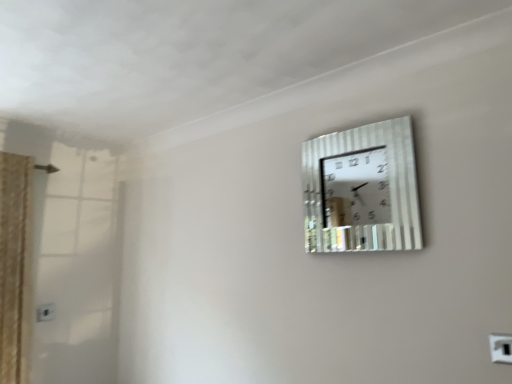
Question: Is white plastic electric outlet at lower left, placed as the 1th electric outlet when sorted from left to right, closer to the viewer compared to metallic silver wall clock at upper right?

Choices:
 (A) yes
 (B) no

Answer: (B)

Question: Can you see white plastic electric outlet at lower left, the first electric outlet when ordered from back to front, touching metallic silver wall clock at upper right?

Choices:
 (A) no
 (B) yes

Answer: (A)

Question: Can you confirm if white plastic electric outlet at lower left, the 2th electric outlet viewed from the front, is wider than metallic silver wall clock at upper right?

Choices:
 (A) no
 (B) yes

Answer: (A)

Question: From the image's perspective, is white plastic electric outlet at lower left, which appears as the second electric outlet when viewed from the right, below metallic silver wall clock at upper right?

Choices:
 (A) no
 (B) yes

Answer: (B)

Question: Is white plastic electric outlet at lower left, the 2th electric outlet viewed from the front, turned away from metallic silver wall clock at upper right?

Choices:
 (A) yes
 (B) no

Answer: (B)

Question: From the image's perspective, is white plastic electric outlet at lower left, the 2th electric outlet viewed from the front, positioned above or below white plastic electric outlet at upper right, which is the first electric outlet in front-to-back order?

Choices:
 (A) above
 (B) below

Answer: (B)

Question: Is point 53,319 closer or farther from the camera than point 504,342?

Choices:
 (A) farther
 (B) closer

Answer: (A)

Question: From a real-world perspective, is white plastic electric outlet at lower left, which appears as the second electric outlet when viewed from the right, above or below white plastic electric outlet at upper right, which is the first electric outlet in front-to-back order?

Choices:
 (A) below
 (B) above

Answer: (B)

Question: In the image, is white plastic electric outlet at lower left, which appears as the second electric outlet when viewed from the right, on the left side or the right side of white plastic electric outlet at upper right, the 2th electric outlet from the back?

Choices:
 (A) left
 (B) right

Answer: (A)

Question: From the image's perspective, is white plastic electric outlet at lower left, the 2th electric outlet viewed from the front, positioned above or below metallic silver wall clock at upper right?

Choices:
 (A) above
 (B) below

Answer: (B)

Question: Considering the positions of white plastic electric outlet at lower left, which appears as the second electric outlet when viewed from the right, and metallic silver wall clock at upper right in the image, is white plastic electric outlet at lower left, which appears as the second electric outlet when viewed from the right, bigger or smaller than metallic silver wall clock at upper right?

Choices:
 (A) big
 (B) small

Answer: (B)

Question: Choose the correct answer: Is white plastic electric outlet at lower left, placed as the 1th electric outlet when sorted from left to right, inside metallic silver wall clock at upper right or outside it?

Choices:
 (A) outside
 (B) inside

Answer: (A)

Question: In the image, is white plastic electric outlet at lower left, placed as the 1th electric outlet when sorted from left to right, positioned in front of or behind metallic silver wall clock at upper right?

Choices:
 (A) front
 (B) behind

Answer: (B)

Question: Is white plastic electric outlet at upper right, which is the first electric outlet in front-to-back order, inside the boundaries of white plastic electric outlet at lower left, the first electric outlet when ordered from back to front, or outside?

Choices:
 (A) outside
 (B) inside

Answer: (A)

Question: From the image's perspective, is white plastic electric outlet at upper right, marked as the 1th electric outlet in a right-to-left arrangement, above or below white plastic electric outlet at lower left, positioned as the 1th electric outlet in bottom-to-top order?

Choices:
 (A) above
 (B) below

Answer: (A)